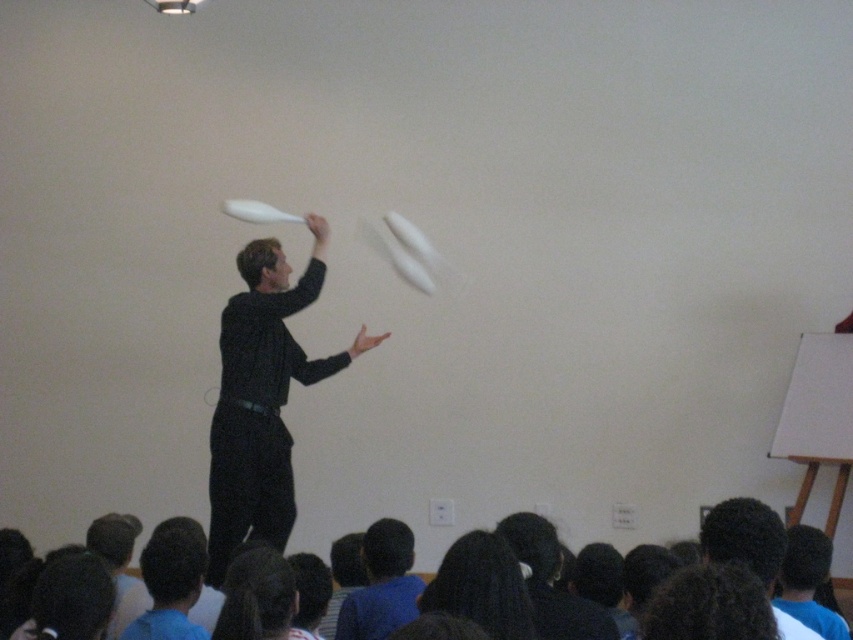
Looking at this image, is smooth black shirt at center positioned behind dark brown hair at lower right?

Yes, it is behind dark brown hair at lower right.

Who is more distant from viewer, (357,592) or (705,524)?

The point (357,592) is behind.

Where is `smooth black shirt at center`? smooth black shirt at center is located at coordinates (381, 584).

Based on the photo, does black matte shirt at center have a larger size compared to smooth black shirt at center?

Yes.

Between point (306, 266) and point (364, 612), which one is positioned in front?

Point (364, 612) is more forward.

The width and height of the screenshot is (853, 640). I want to click on black matte shirt at center, so click(262, 397).

In the scene shown: Which is more to the right, black matte shirt at center or dark brown hair at lower right?

dark brown hair at lower right

Can you confirm if black matte shirt at center is positioned above dark brown hair at lower right?

Yes, black matte shirt at center is above dark brown hair at lower right.

Which is in front, point (268, 349) or point (762, 544)?

Point (762, 544) is in front.

I want to click on black matte shirt at center, so click(262, 397).